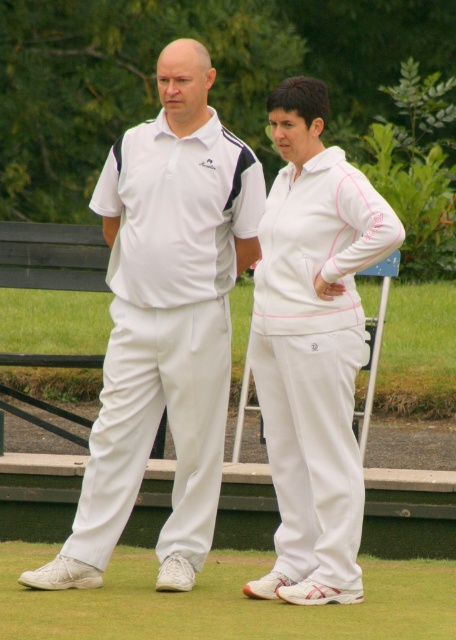
Question: Is white cotton polo shirt at center positioned in front of white matte tracksuit at center?

Choices:
 (A) no
 (B) yes

Answer: (A)

Question: Which point is closer to the camera?

Choices:
 (A) (14, 616)
 (B) (296, 544)

Answer: (A)

Question: Among these points, which one is farthest from the camera?

Choices:
 (A) (182, 410)
 (B) (257, 611)

Answer: (A)

Question: Among these objects, which one is farthest from the camera?

Choices:
 (A) white fabric pants at lower center
 (B) white matte tracksuit at center
 (C) white cotton polo shirt at center

Answer: (C)

Question: Where is white matte tracksuit at center located in relation to white fabric pants at lower center in the image?

Choices:
 (A) right
 (B) left

Answer: (A)

Question: Does white matte tracksuit at center have a greater width compared to white fabric pants at lower center?

Choices:
 (A) yes
 (B) no

Answer: (B)